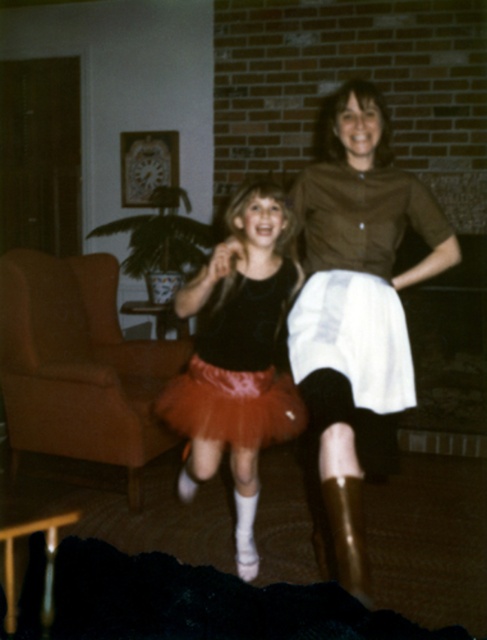
Question: Can you confirm if matte orange tutu skirt at center is positioned to the left of shiny gold boot at lower center?

Choices:
 (A) yes
 (B) no

Answer: (A)

Question: Which is farther from the shiny gold boot at lower center?

Choices:
 (A) matte pink tulle skirt at center
 (B) brown leather armchair at left
 (C) matte orange tutu skirt at center

Answer: (B)

Question: Which point is farther to the camera?

Choices:
 (A) shiny gold boot at lower center
 (B) matte orange tutu skirt at center
 (C) brown leather armchair at left
 (D) matte pink tulle skirt at center

Answer: (C)

Question: Considering the relative positions of matte pink tulle skirt at center and shiny gold boot at lower center in the image provided, where is matte pink tulle skirt at center located with respect to shiny gold boot at lower center?

Choices:
 (A) right
 (B) left

Answer: (B)

Question: Based on their relative distances, which object is farther from the matte pink tulle skirt at center?

Choices:
 (A) shiny gold boot at lower center
 (B) brown matte skirt at center
 (C) brown leather armchair at left
 (D) matte orange tutu skirt at center

Answer: (C)

Question: Is brown matte skirt at center above brown leather armchair at left?

Choices:
 (A) yes
 (B) no

Answer: (A)